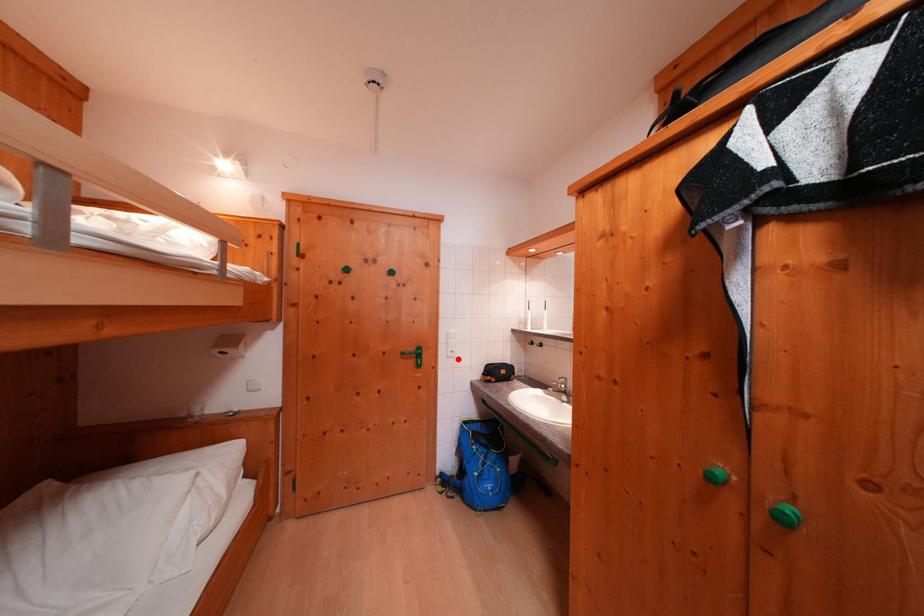
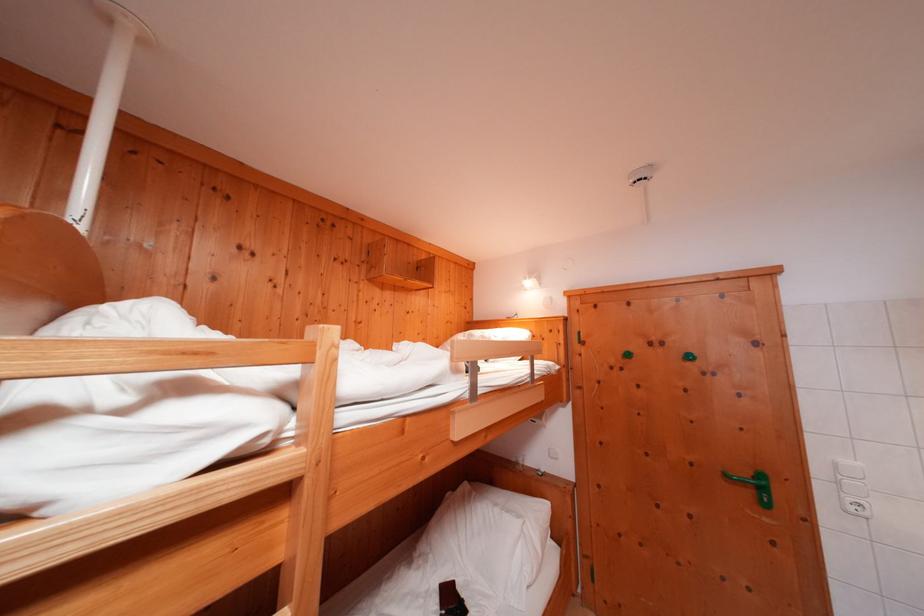
Question: I am providing you with two images of the same scene from different viewpoints. In image1, a red point is highlighted. Considering the same 3D point in image2, which of the following is correct?

Choices:
 (A) It is closer
 (B) It is farther

Answer: (A)